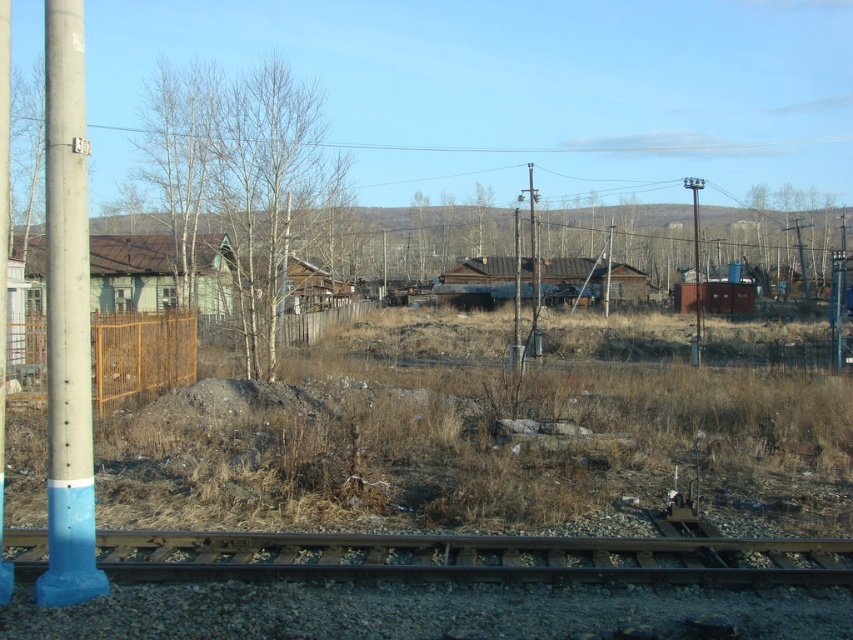
You are a painter standing at the edge of the railway track. You need to paint both the bare wood tree at center and the metallic pole at center. Which object should you paint first if you want to start with the wider one?

The bare wood tree at center might be wider than metallic pole at center, so you should start painting the bare wood tree at center first.

You are a painter who wants to paint the bare wood tree at center and the metallic pole at center. Since you have limited paint, you need to know which object requires more paint to cover its surface. Based on the scene, which one would need more paint?

The bare wood tree at center requires more paint because it is larger in size than the metallic pole at center.